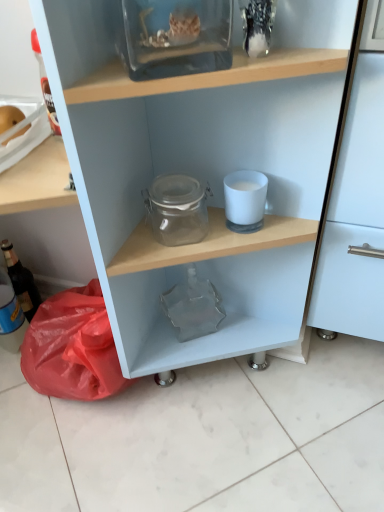
Question: Would you say transparent glass jar at center is inside or outside matte glass bottle at left?

Choices:
 (A) inside
 (B) outside

Answer: (B)

Question: Is transparent glass jar at center in front of or behind matte glass bottle at left in the image?

Choices:
 (A) front
 (B) behind

Answer: (A)

Question: Which object is the closest to the transparent glass jar at center?

Choices:
 (A) transparent glass jar at center
 (B) transparent glass jar at upper center
 (C) matte glass bottle at left

Answer: (A)

Question: Estimate the real-world distances between objects in this image. Which object is farther from the matte glass bottle at left?

Choices:
 (A) transparent glass jar at center
 (B) transparent glass jar at upper center
 (C) transparent glass jar at center

Answer: (B)